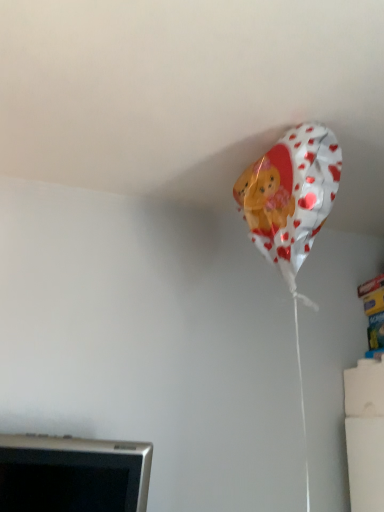
You are a GUI agent. You are given a task and a screenshot of the screen. Output one action in this format:
    pyautogui.click(x=<x>, y=<y>)
    Task: Click on the metallic silver balloon at upper right
    The height and width of the screenshot is (512, 384).
    Given the screenshot: What is the action you would take?
    pyautogui.click(x=291, y=197)

Describe the element at coordinates (291, 197) in the screenshot. This screenshot has width=384, height=512. I see `metallic silver balloon at upper right` at that location.

Where is `metallic silver balloon at upper right`? metallic silver balloon at upper right is located at coordinates (291, 197).